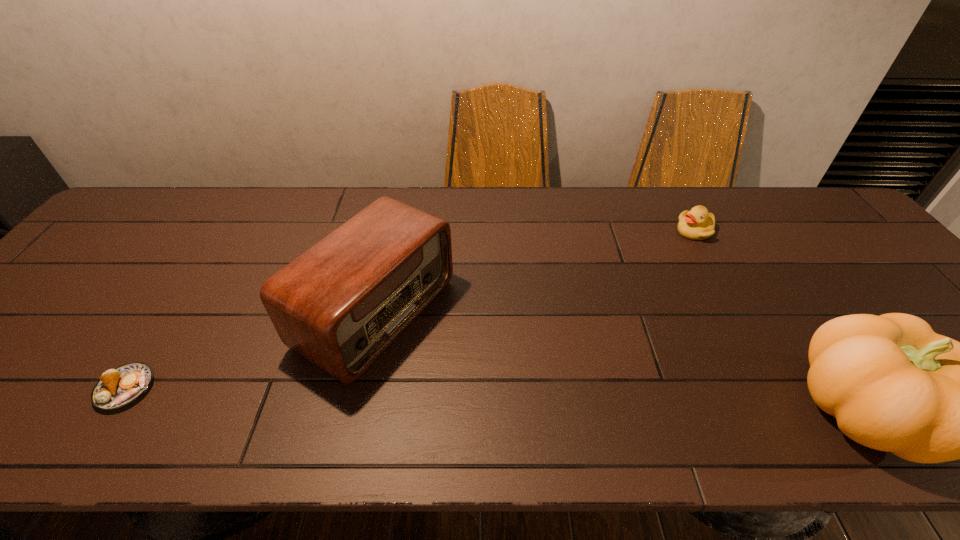
Locate an element on the screen. Image resolution: width=960 pixels, height=540 pixels. free spot on the desktop that is between the shortest object and the pumpkin and is positioned on the front-facing side of the farthest object is located at coordinates (540, 400).

The height and width of the screenshot is (540, 960). I want to click on vacant space on the desktop that is between the shortest object and the pumpkin and is positioned on the front panel of the radio receiver, so click(540, 400).